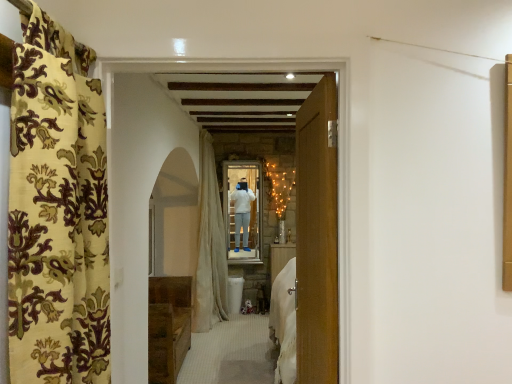
Question: Is brown wooden chest at lower left smaller than white sheer curtain at center, the first curtain in the back-to-front sequence?

Choices:
 (A) yes
 (B) no

Answer: (A)

Question: Is brown wooden chest at lower left closer to the viewer compared to white sheer curtain at center, marked as the second curtain in a front-to-back arrangement?

Choices:
 (A) no
 (B) yes

Answer: (B)

Question: Can you confirm if brown wooden chest at lower left is shorter than white sheer curtain at center, marked as the second curtain in a front-to-back arrangement?

Choices:
 (A) yes
 (B) no

Answer: (A)

Question: Is brown wooden chest at lower left further to the viewer compared to white sheer curtain at center, the first curtain in the back-to-front sequence?

Choices:
 (A) no
 (B) yes

Answer: (A)

Question: Can you confirm if brown wooden chest at lower left is positioned to the right of white sheer curtain at center, marked as the second curtain in a front-to-back arrangement?

Choices:
 (A) yes
 (B) no

Answer: (B)

Question: Is the surface of brown wooden chest at lower left in direct contact with white sheer curtain at center, the first curtain in the back-to-front sequence?

Choices:
 (A) yes
 (B) no

Answer: (B)

Question: Can you confirm if wooden door at center is taller than brown wooden chest at lower left?

Choices:
 (A) no
 (B) yes

Answer: (B)

Question: Can you confirm if wooden door at center is bigger than brown wooden chest at lower left?

Choices:
 (A) yes
 (B) no

Answer: (B)

Question: Can you see wooden door at center touching brown wooden chest at lower left?

Choices:
 (A) no
 (B) yes

Answer: (A)

Question: From a real-world perspective, is wooden door at center positioned under brown wooden chest at lower left based on gravity?

Choices:
 (A) no
 (B) yes

Answer: (A)

Question: From a real-world perspective, is wooden door at center over brown wooden chest at lower left?

Choices:
 (A) yes
 (B) no

Answer: (A)

Question: Considering the relative sizes of wooden door at center and brown wooden chest at lower left in the image provided, is wooden door at center thinner than brown wooden chest at lower left?

Choices:
 (A) yes
 (B) no

Answer: (A)

Question: Can you confirm if velvet floral curtain at left, the second curtain viewed from the back, is positioned to the left of wooden door at center?

Choices:
 (A) yes
 (B) no

Answer: (A)